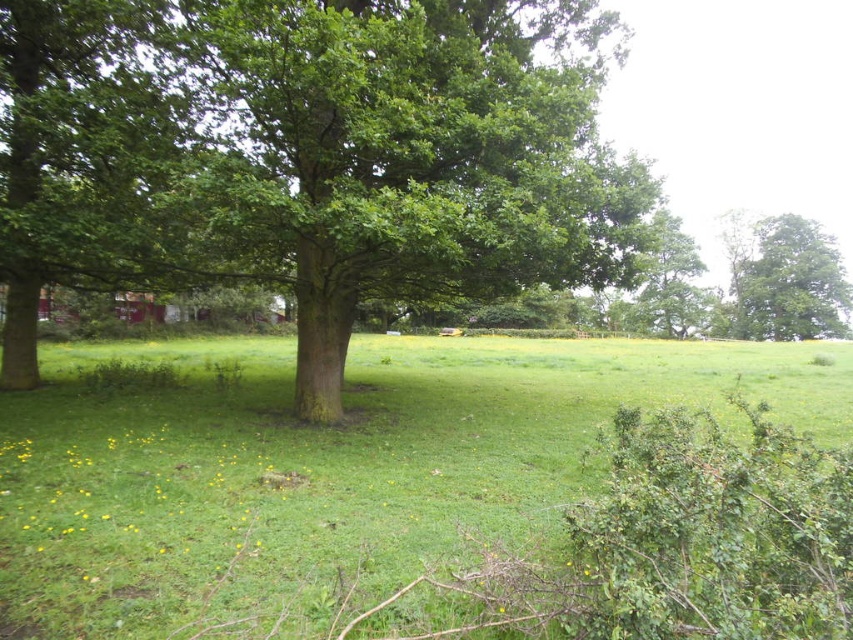
Question: Is green grass at center to the right of green leafy tree at upper right from the viewer's perspective?

Choices:
 (A) yes
 (B) no

Answer: (B)

Question: Is green smooth tree at center in front of green grass at center?

Choices:
 (A) yes
 (B) no

Answer: (B)

Question: Which point is farther to the camera?

Choices:
 (A) (49, 534)
 (B) (828, 314)

Answer: (B)

Question: Which of these objects is positioned farthest from the green leafy tree at upper right?

Choices:
 (A) green smooth tree at center
 (B) green grass at center

Answer: (A)

Question: Does green smooth tree at center appear under green grass at center?

Choices:
 (A) yes
 (B) no

Answer: (B)

Question: Which object is the farthest from the green smooth tree at center?

Choices:
 (A) green grass at center
 (B) green leafy tree at upper right

Answer: (B)